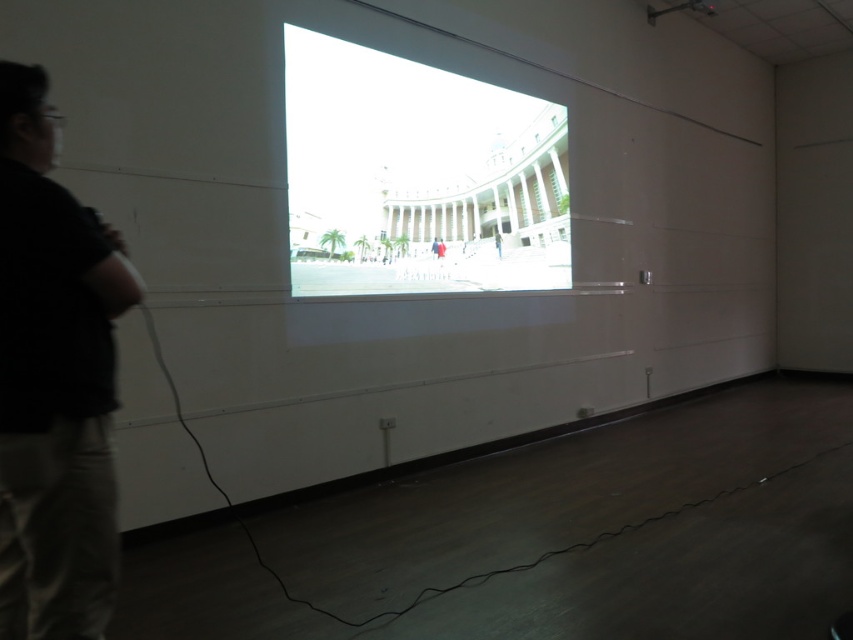
You are standing in the room and want to move from the point at coordinate (469, 122) to the point at coordinate (33, 378). Which direction should you move in to get closer to your destination?

To move closer to the point at coordinate (33, 378) from the point at coordinate (469, 122), you should move downward and to the right since point (469, 122) is further away from the viewer compared to point (33, 378).

You are standing in the room and want to move from the black cotton shirt at left to the bright white projection screen at center. Which direction should you move to reach it?

You should move to your right to reach the bright white projection screen at center because it is located to the right of the black cotton shirt at left.

You are standing in the room and want to know if the bright white projection screen at center is taller than the black cotton shirt at left. Can you confirm this?

The bright white projection screen at center is much taller than the black cotton shirt at left according to the description.